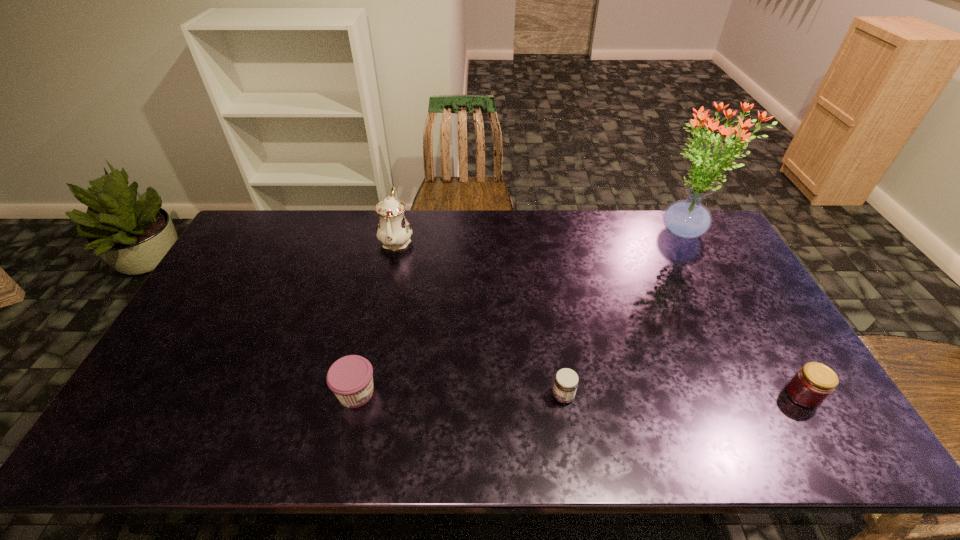
Find the location of a particular element. This screenshot has width=960, height=540. empty location between the tallest object and the third object from right to left is located at coordinates (623, 315).

This screenshot has width=960, height=540. I want to click on object that stands as the third closest to the third object from left to right, so click(x=687, y=219).

The image size is (960, 540). Identify the location of the fourth closest object to the leftmost jam. (813, 383).

Locate an element on the screen. This screenshot has height=540, width=960. the third closest jam relative to the flower arrangement is located at coordinates (350, 378).

You are a GUI agent. You are given a task and a screenshot of the screen. Output one action in this format:
    pyautogui.click(x=<x>, y=<y>)
    Task: Click on the jam that is the closest to the rightmost jam
    The width and height of the screenshot is (960, 540).
    Given the screenshot: What is the action you would take?
    pyautogui.click(x=565, y=385)

Image resolution: width=960 pixels, height=540 pixels. What are the coordinates of `blank area in the image that satisfies the following two spatial constraints: 1. on the front side of the tallest object; 2. on the front label of the third object from left to right` in the screenshot? It's located at (767, 396).